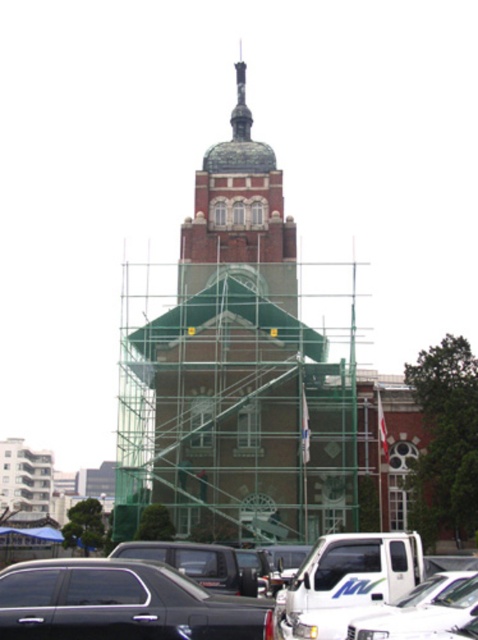
Question: Among these points, which one is nearest to the camera?

Choices:
 (A) [44, 564]
 (B) [393, 620]
 (C) [291, 381]
 (D) [30, 595]

Answer: (D)

Question: Is brown brick tower at center bigger than shiny black sedan at center?

Choices:
 (A) yes
 (B) no

Answer: (A)

Question: From the image, what is the correct spatial relationship of shiny black sedan at lower left in relation to white matte truck at center?

Choices:
 (A) right
 (B) left

Answer: (B)

Question: Based on their relative distances, which object is nearer to the shiny black sedan at center?

Choices:
 (A) shiny black sedan at lower left
 (B) white matte truck at center

Answer: (A)

Question: Estimate the real-world distances between objects in this image. Which object is closer to the shiny black sedan at lower left?

Choices:
 (A) shiny black sedan at center
 (B) white matte truck at center

Answer: (A)

Question: In this image, where is brown brick tower at center located relative to shiny black sedan at center?

Choices:
 (A) below
 (B) above

Answer: (B)